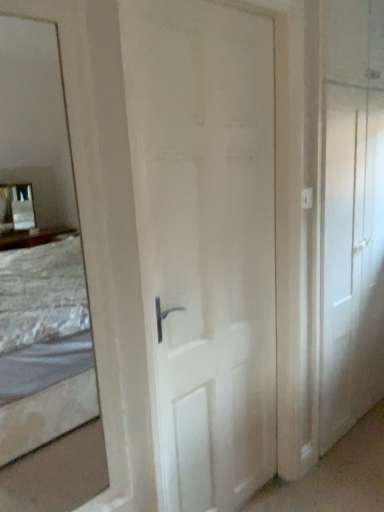
Locate an element on the screen. The image size is (384, 512). free space in front of white matte door at right, marked as the 1th door in a right-to-left arrangement is located at coordinates tap(350, 461).